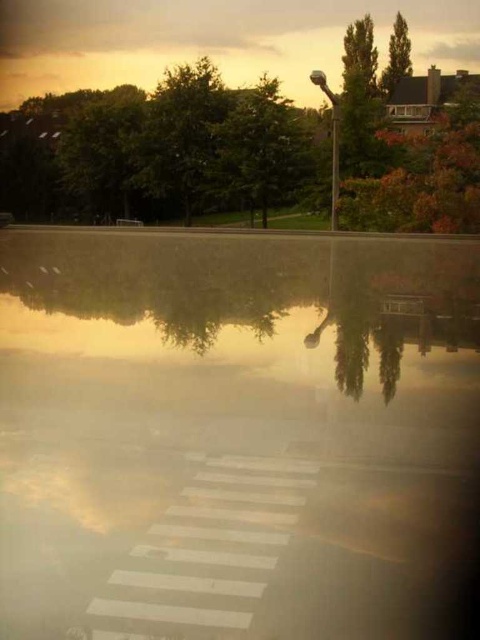
Question: Is transparent glass water at center to the right of green leafy tree at upper right from the viewer's perspective?

Choices:
 (A) no
 (B) yes

Answer: (A)

Question: Which of the following is the farthest from the observer?

Choices:
 (A) autumn leaves at upper right
 (B) green leafy tree at upper right
 (C) transparent glass water at center

Answer: (B)

Question: Does transparent glass water at center appear under autumn leaves at upper right?

Choices:
 (A) no
 (B) yes

Answer: (B)

Question: Which object appears closest to the camera in this image?

Choices:
 (A) transparent glass water at center
 (B) autumn leaves at upper right
 (C) green leafy tree at upper right

Answer: (A)

Question: Estimate the real-world distances between objects in this image. Which object is farther from the transparent glass water at center?

Choices:
 (A) autumn leaves at upper right
 (B) green leafy tree at upper right

Answer: (B)

Question: Can you confirm if transparent glass water at center is thinner than autumn leaves at upper right?

Choices:
 (A) no
 (B) yes

Answer: (A)